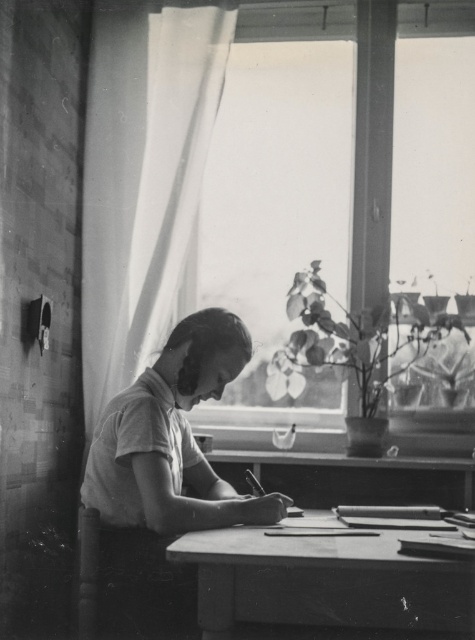
Can you confirm if smooth white shirt at center is positioned to the left of wooden table at center?

Correct, you'll find smooth white shirt at center to the left of wooden table at center.

How distant is smooth white shirt at center from wooden table at center?

smooth white shirt at center and wooden table at center are 30.84 centimeters apart from each other.

Is point (193, 490) closer to viewer compared to point (351, 552)?

No, (193, 490) is further to viewer.

Image resolution: width=475 pixels, height=640 pixels. In order to click on smooth white shirt at center in this screenshot , I will do `click(164, 472)`.

Who is higher up, transparent glass window at center or wooden table at center?

Positioned higher is transparent glass window at center.

Is point (374, 102) behind point (385, 592)?

That is True.

In order to click on transparent glass window at center in this screenshot , I will do `click(279, 204)`.

Does transparent glass window at center have a greater height compared to smooth white shirt at center?

Yes.

Measure the distance between transparent glass window at center and camera.

2.58 meters

Locate an element on the screen. transparent glass window at center is located at coordinates (279, 204).